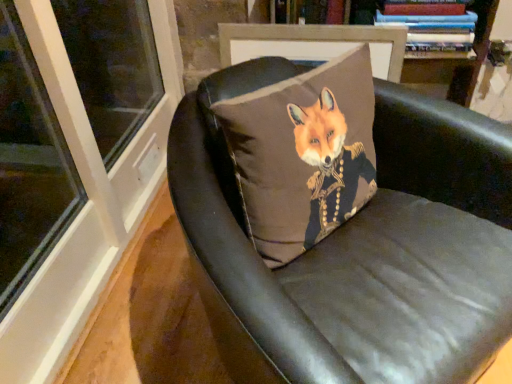
What is the approximate height of matte brown pillow with fox design at center?

The height of matte brown pillow with fox design at center is 14.68 inches.

What is the approximate width of leather cushion at center?

The width of leather cushion at center is 31.17 inches.

This screenshot has height=384, width=512. What do you see at coordinates (433, 28) in the screenshot? I see `hardcover books at upper right` at bounding box center [433, 28].

You are a GUI agent. You are given a task and a screenshot of the screen. Output one action in this format:
    pyautogui.click(x=<x>, y=<y>)
    Task: Click on the matte brown pillow with fox design at center
    This screenshot has width=512, height=384.
    Given the screenshot: What is the action you would take?
    pyautogui.click(x=303, y=154)

How much distance is there between leather cushion at center and hardcover books at upper right?

leather cushion at center is 71.42 centimeters away from hardcover books at upper right.

Considering the positions of objects leather cushion at center and hardcover books at upper right in the image provided, who is in front, leather cushion at center or hardcover books at upper right?

leather cushion at center.

Does leather cushion at center contain hardcover books at upper right?

Definitely not — hardcover books at upper right is not inside leather cushion at center.

Is leather cushion at center bigger than hardcover books at upper right?

Correct, leather cushion at center is larger in size than hardcover books at upper right.

Would you say leather cushion at center is to the left or to the right of matte brown pillow with fox design at center in the picture?

leather cushion at center is to the right of matte brown pillow with fox design at center.

From the image's perspective, would you say leather cushion at center is positioned over matte brown pillow with fox design at center?

No, from the image's perspective, leather cushion at center is not over matte brown pillow with fox design at center.

Is leather cushion at center in front of or behind matte brown pillow with fox design at center in the image?

Visually, leather cushion at center is located in front of matte brown pillow with fox design at center.

Is hardcover books at upper right wider or thinner than leather cushion at center?

In the image, hardcover books at upper right appears to be more narrow than leather cushion at center.

Is hardcover books at upper right inside or outside of leather cushion at center?

hardcover books at upper right cannot be found inside leather cushion at center.

Does hardcover books at upper right lie behind leather cushion at center?

That is True.

In the scene shown: Can you confirm if hardcover books at upper right is smaller than leather cushion at center?

Yes.

Which is behind, matte brown pillow with fox design at center or leather cushion at center?

matte brown pillow with fox design at center is more distant.

This screenshot has width=512, height=384. I want to click on chair on the right of the matte brown pillow with fox design at center, so click(357, 248).

Can you confirm if matte brown pillow with fox design at center is positioned to the left of leather cushion at center?

Correct, you'll find matte brown pillow with fox design at center to the left of leather cushion at center.

Can you confirm if hardcover books at upper right is positioned to the right of matte brown pillow with fox design at center?

Indeed, hardcover books at upper right is positioned on the right side of matte brown pillow with fox design at center.

Is the position of hardcover books at upper right less distant than that of matte brown pillow with fox design at center?

No, it is not.

From a real-world perspective, which is physically below, hardcover books at upper right or matte brown pillow with fox design at center?

From a 3D spatial view, matte brown pillow with fox design at center is below.

Is hardcover books at upper right aimed at matte brown pillow with fox design at center?

Yes.

Between matte brown pillow with fox design at center and hardcover books at upper right, which one appears on the right side from the viewer's perspective?

hardcover books at upper right is more to the right.

From a real-world perspective, is matte brown pillow with fox design at center beneath hardcover books at upper right?

Yes, from a real-world perspective, matte brown pillow with fox design at center is under hardcover books at upper right.

Does matte brown pillow with fox design at center have a smaller size compared to hardcover books at upper right?

No.

You are a GUI agent. You are given a task and a screenshot of the screen. Output one action in this format:
    pyautogui.click(x=<x>, y=<y>)
    Task: Click on the book on the right side of leather cushion at center
    Image resolution: width=512 pixels, height=384 pixels.
    Given the screenshot: What is the action you would take?
    point(433,28)

You are a GUI agent. You are given a task and a screenshot of the screen. Output one action in this format:
    pyautogui.click(x=<x>, y=<y>)
    Task: Click on the chair below the matte brown pillow with fox design at center (from the image's perspective)
    
    Given the screenshot: What is the action you would take?
    pyautogui.click(x=357, y=248)

Based on their spatial positions, is leather cushion at center or hardcover books at upper right closer to matte brown pillow with fox design at center?

The object closer to matte brown pillow with fox design at center is leather cushion at center.

Based on their spatial positions, is matte brown pillow with fox design at center or leather cushion at center closer to hardcover books at upper right?

matte brown pillow with fox design at center is positioned closer to the anchor hardcover books at upper right.

Which object lies further to the anchor point leather cushion at center, hardcover books at upper right or matte brown pillow with fox design at center?

The object further to leather cushion at center is hardcover books at upper right.

Estimate the real-world distances between objects in this image. Which object is further from matte brown pillow with fox design at center, hardcover books at upper right or leather cushion at center?

The object further to matte brown pillow with fox design at center is hardcover books at upper right.

In the scene shown: Based on their spatial positions, is leather cushion at center or matte brown pillow with fox design at center further from hardcover books at upper right?

leather cushion at center lies further to hardcover books at upper right than the other object.

Estimate the real-world distances between objects in this image. Which object is closer to leather cushion at center, matte brown pillow with fox design at center or hardcover books at upper right?

matte brown pillow with fox design at center is closer to leather cushion at center.

In order to click on pillow located between leather cushion at center and hardcover books at upper right in the depth direction in this screenshot , I will do `click(303, 154)`.